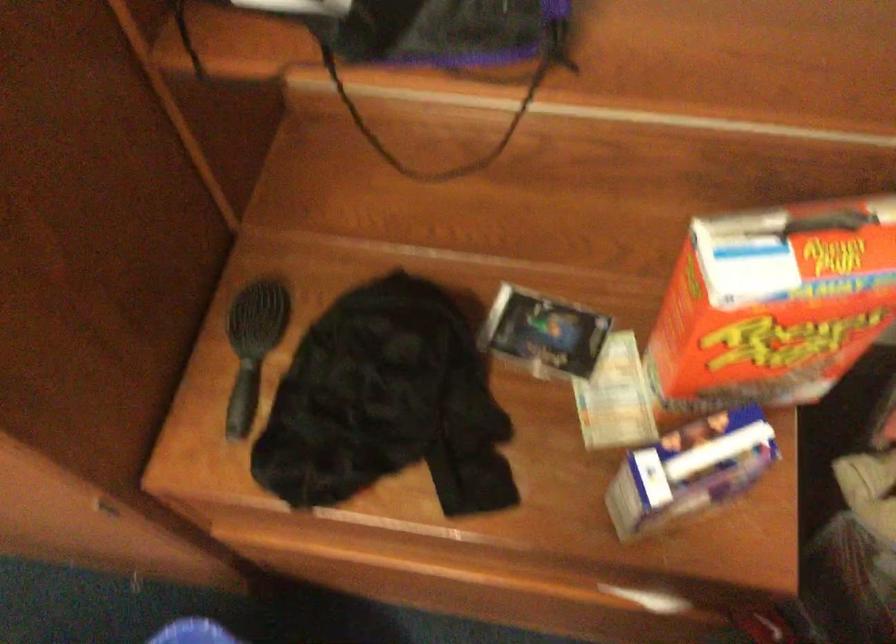
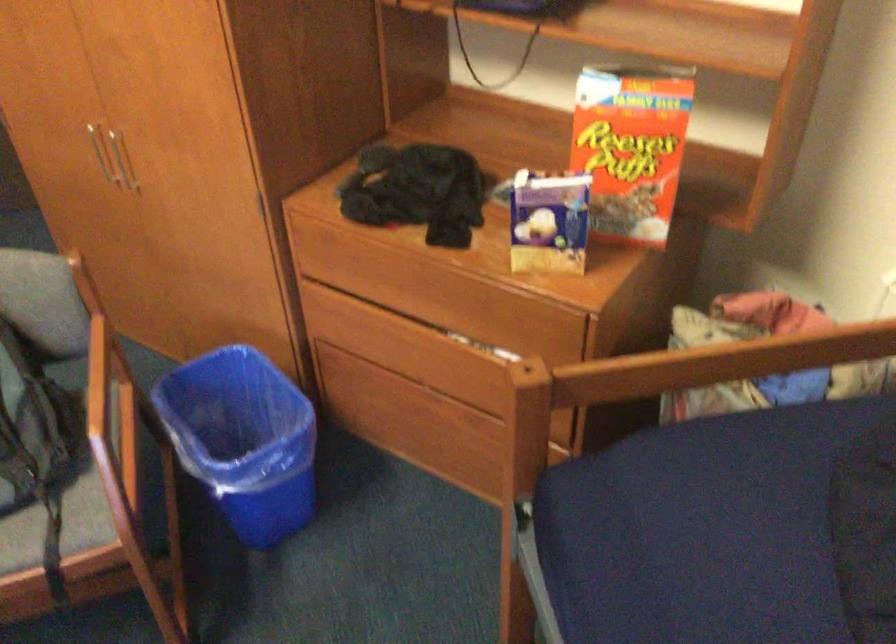
Where in the second image is the point corresponding to point 790,328 from the first image?

(631, 146)